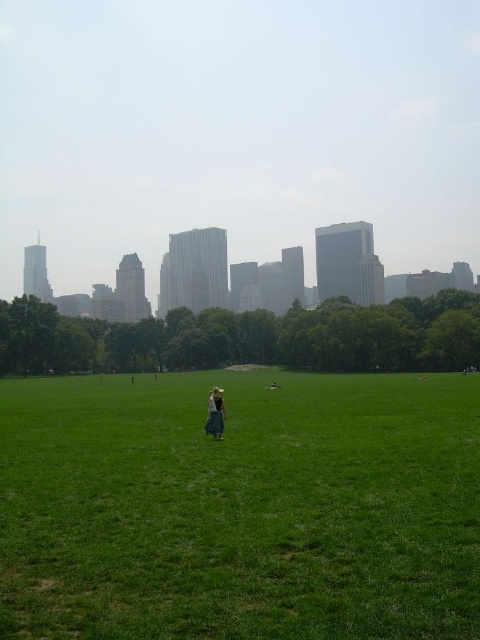
Question: Which point is farther to the camera?

Choices:
 (A) light brown fabric dress at center
 (B) green grass at center

Answer: (A)

Question: From the image, what is the correct spatial relationship of green grass at center in relation to light brown fabric dress at center?

Choices:
 (A) right
 (B) left

Answer: (B)

Question: Does green grass at center appear on the right side of light brown fabric dress at center?

Choices:
 (A) yes
 (B) no

Answer: (B)

Question: Is green grass at center above light brown fabric dress at center?

Choices:
 (A) yes
 (B) no

Answer: (B)

Question: Which point is farther to the camera?

Choices:
 (A) light brown fabric dress at center
 (B) green grass at center

Answer: (A)

Question: Which point is farther to the camera?

Choices:
 (A) light brown fabric dress at center
 (B) green grass at center

Answer: (A)